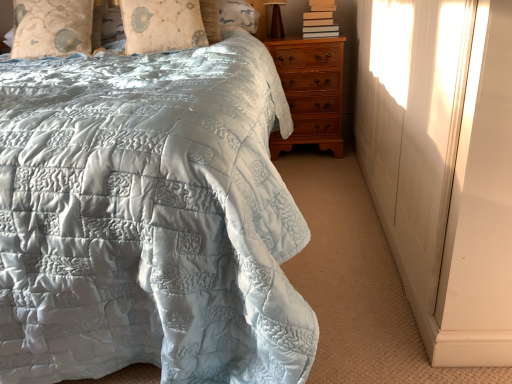
The image size is (512, 384). In order to click on vacant area that is in front of brown wooden table lamp at upper right in this screenshot , I will do `click(279, 39)`.